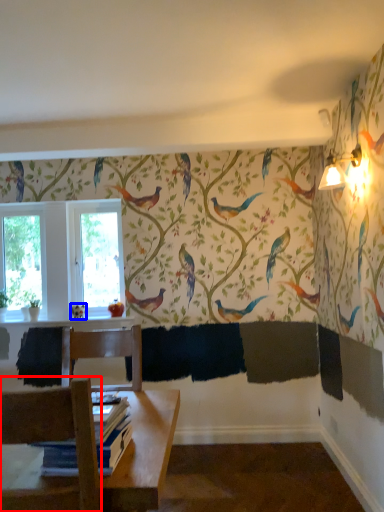
Question: Which point is further to the camera, chair (highlighted by a red box) or bird (highlighted by a blue box)?

Choices:
 (A) chair
 (B) bird

Answer: (B)